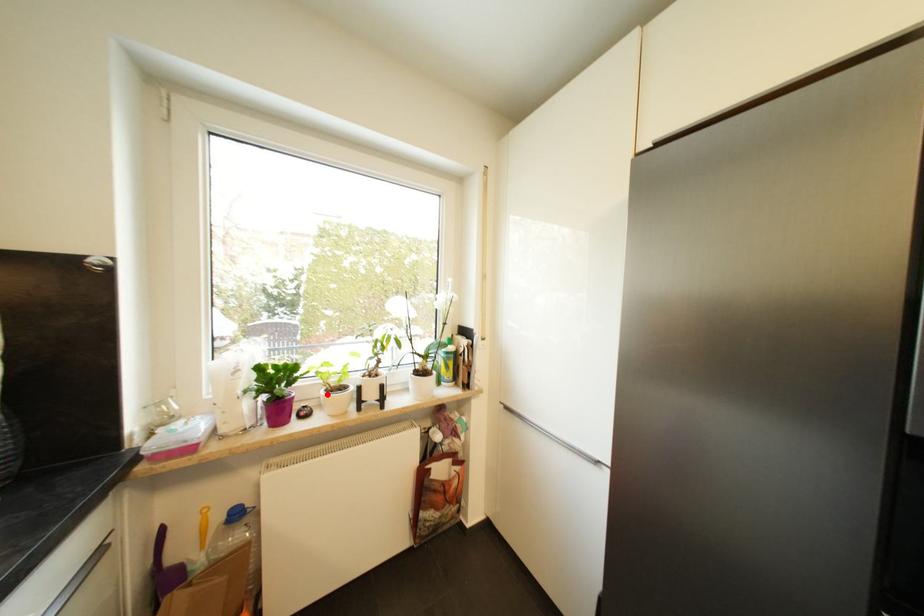
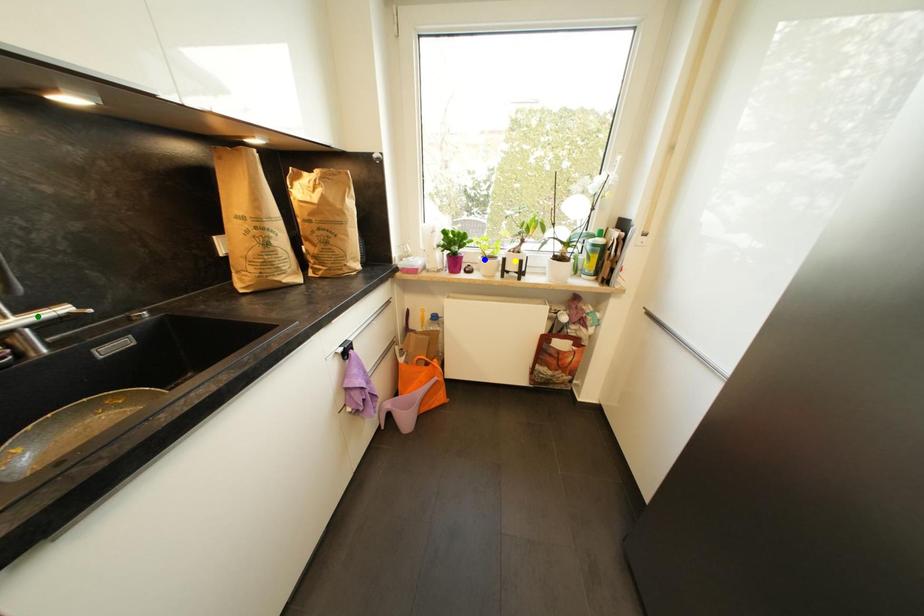
Question: I am providing you with two images of the same scene from different viewpoints. A red point is marked on the first image. You are given multiple points on the second image. Which point in image 2 is actually the same real-world point as the red point in image 1?

Choices:
 (A) green point
 (B) yellow point
 (C) blue point

Answer: (C)